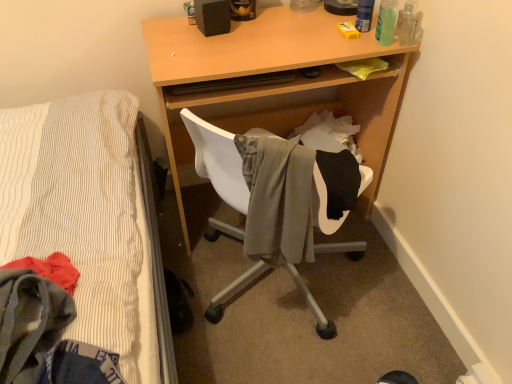
Where is `vacant area situated to the left side of clear plastic bottle at upper right, marked as the third bottle in a left-to-right arrangement`? Image resolution: width=512 pixels, height=384 pixels. vacant area situated to the left side of clear plastic bottle at upper right, marked as the third bottle in a left-to-right arrangement is located at coordinates (340, 36).